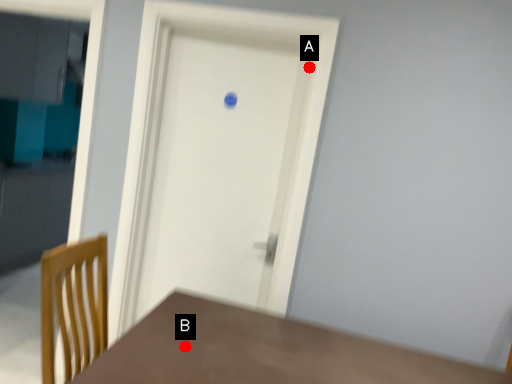
Question: Two points are circled on the image, labeled by A and B beside each circle. Which point is farther from the camera taking this photo?

Choices:
 (A) A is further
 (B) B is further

Answer: (A)